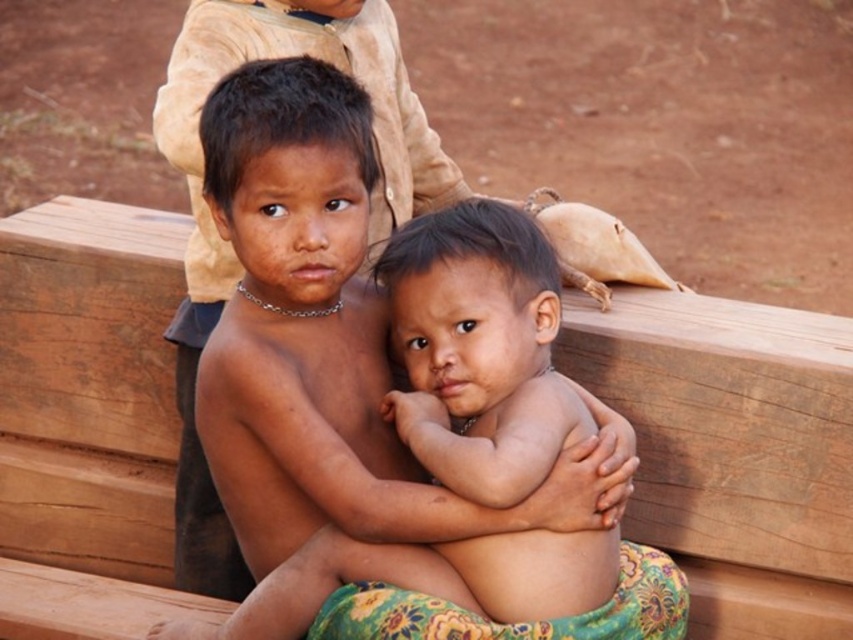
Does brown wooden bench at center lie behind smooth skin child at center?

Yes, brown wooden bench at center is behind smooth skin child at center.

Is brown wooden bench at center bigger than smooth skin child at center?

Incorrect, brown wooden bench at center is not larger than smooth skin child at center.

Find the location of a particular element. brown wooden bench at center is located at coordinates (732, 451).

At what (x,y) coordinates should I click in order to perform the action: click on brown wooden bench at center. Please return your answer as a coordinate pair (x, y). The image size is (853, 640). Looking at the image, I should click on (732, 451).